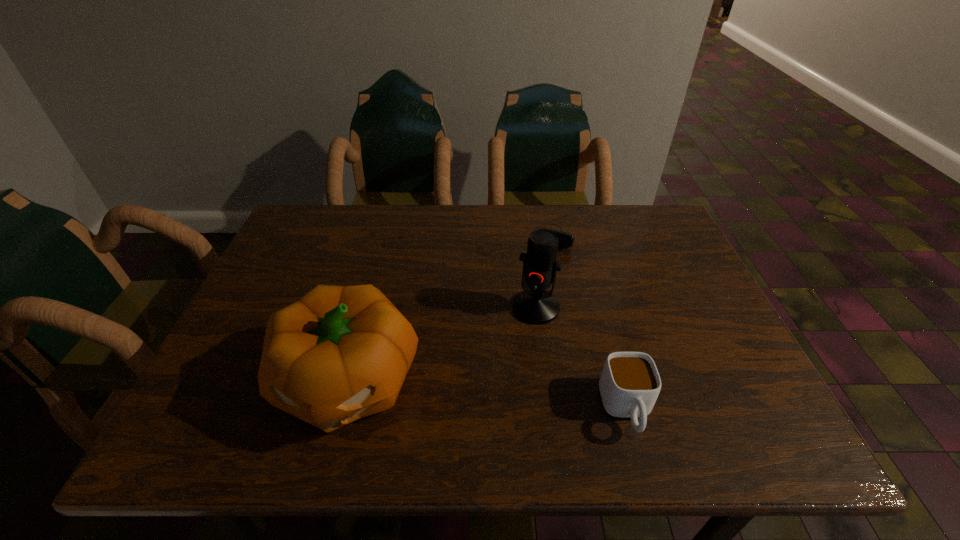
Identify the location of vacant space situated 0.170m on the front-facing side of the webcam. (541, 289).

The image size is (960, 540). Find the location of `object located in the far edge section of the desktop`. object located in the far edge section of the desktop is located at coordinates (566, 240).

Locate an element on the screen. Image resolution: width=960 pixels, height=540 pixels. pumpkin that is at the near edge is located at coordinates (338, 354).

At what (x,y) coordinates should I click in order to perform the action: click on cup that is at the near edge. Please return your answer as a coordinate pair (x, y). Looking at the image, I should click on (629, 385).

Find the location of `object located at the left edge`. object located at the left edge is located at coordinates (338, 354).

At what (x,y) coordinates should I click in order to perform the action: click on object at the near left corner. Please return your answer as a coordinate pair (x, y). Looking at the image, I should click on (338, 354).

At what (x,y) coordinates should I click in order to perform the action: click on vacant space at the far edge. Please return your answer as a coordinate pair (x, y). Looking at the image, I should click on (368, 231).

The image size is (960, 540). In the image, there is a desktop. In order to click on blank space at the near edge in this screenshot , I will do `click(466, 390)`.

The image size is (960, 540). Find the location of `free space at the left edge of the desktop`. free space at the left edge of the desktop is located at coordinates (318, 266).

The image size is (960, 540). In the image, there is a desktop. What are the coordinates of `vacant area at the right edge` in the screenshot? It's located at (708, 341).